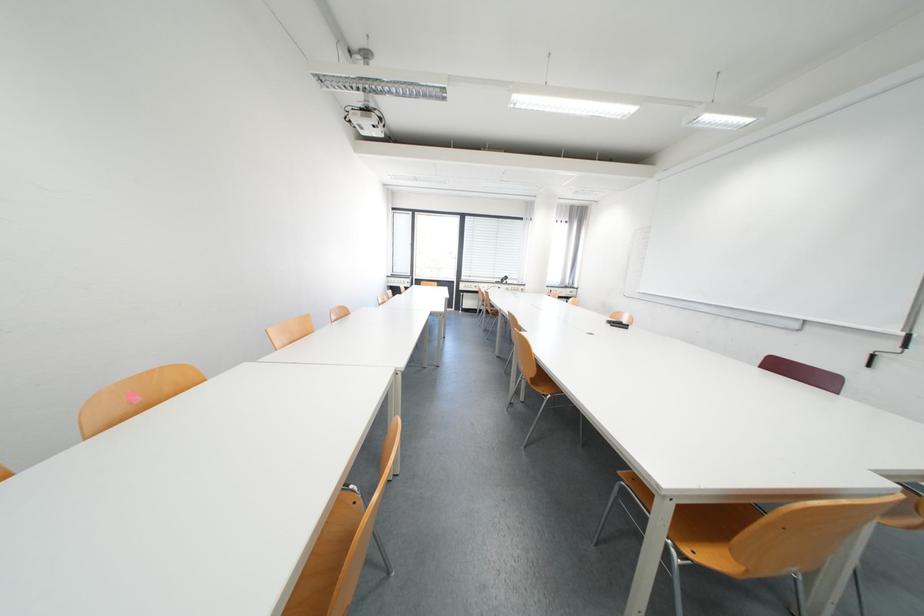
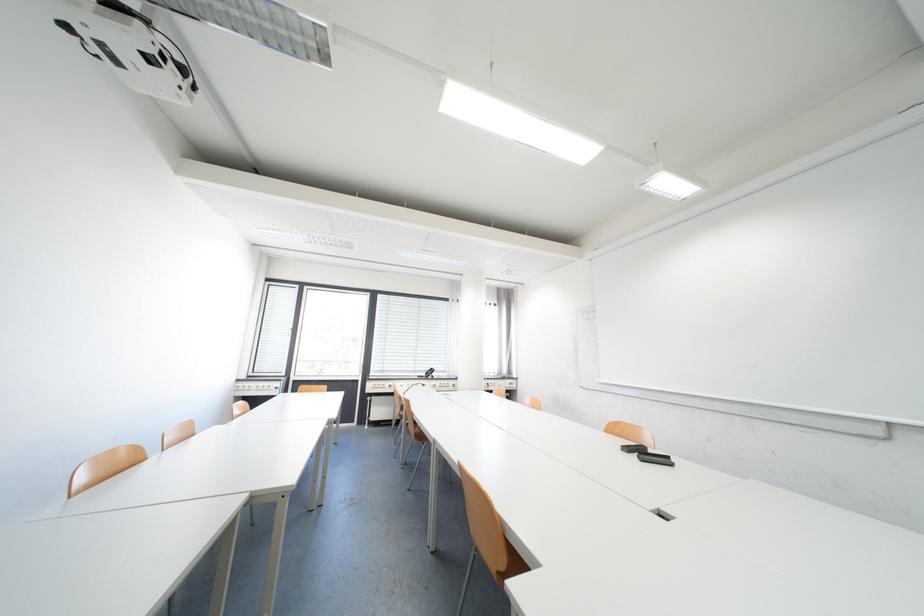
Question: What movement of the cameraman would produce the second image?

Choices:
 (A) Left
 (B) Right
 (C) Forward
 (D) Backward

Answer: (C)